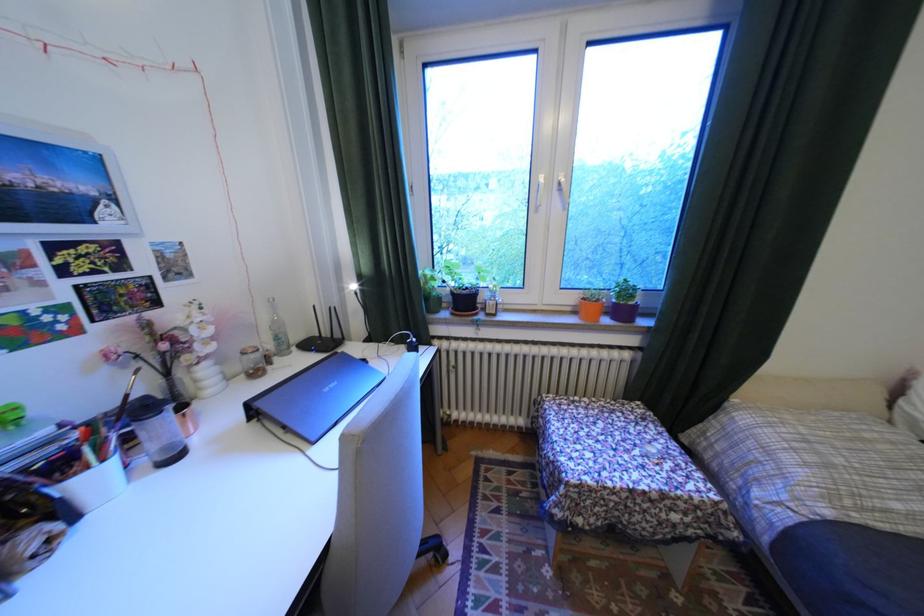
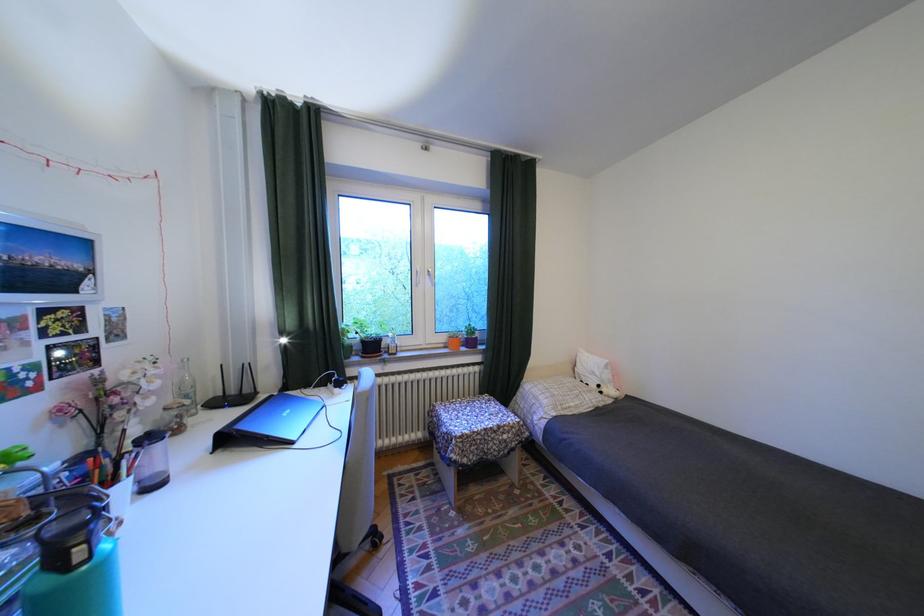
Question: How did the camera likely rotate?

Choices:
 (A) Left
 (B) Right
 (C) Up
 (D) Down

Answer: (B)